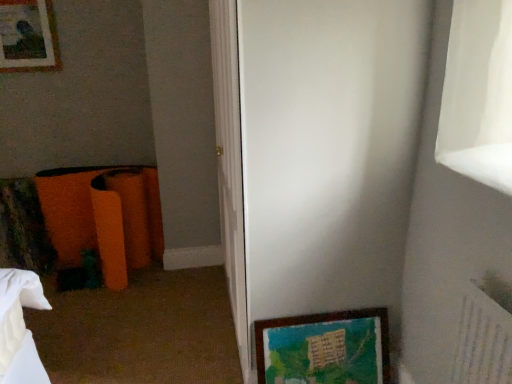
Question: Which is correct: matte wooden picture frame at upper left, the second picture frame positioned from the front, is inside white glossy screen door at center, or outside of it?

Choices:
 (A) inside
 (B) outside

Answer: (B)

Question: Would you say matte wooden picture frame at upper left, the second picture frame positioned from the front, is to the left or to the right of white glossy screen door at center in the picture?

Choices:
 (A) left
 (B) right

Answer: (A)

Question: Which object is the closest to the matte wooden picture frame at upper left, the first picture frame viewed from the back?

Choices:
 (A) wooden framed artwork at lower right, which appears as the second picture frame when viewed from the left
 (B) white glossy screen door at center

Answer: (B)

Question: Which is nearer to the matte wooden picture frame at upper left, which ranks as the first picture frame in left-to-right order?

Choices:
 (A) wooden framed artwork at lower right, which appears as the second picture frame when viewed from the left
 (B) white glossy screen door at center

Answer: (B)